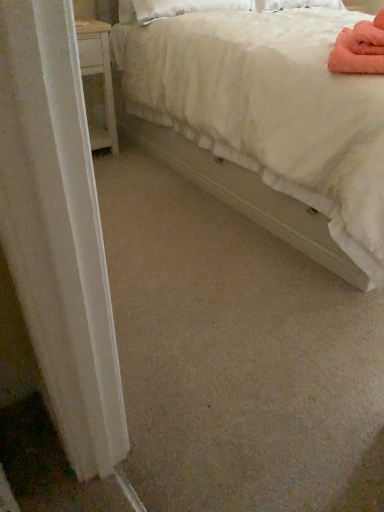
This screenshot has height=512, width=384. What do you see at coordinates (359, 48) in the screenshot? I see `pink fluffy bath towel at upper right` at bounding box center [359, 48].

The image size is (384, 512). What are the coordinates of `pink fluffy bath towel at upper right` in the screenshot? It's located at (359, 48).

Image resolution: width=384 pixels, height=512 pixels. I want to click on white fluffy bed at upper right, so click(265, 116).

What is the approximate width of white fluffy bed at upper right?

It is 7.21 feet.

Describe the element at coordinates (265, 116) in the screenshot. I see `white fluffy bed at upper right` at that location.

Locate an element on the screen. The width and height of the screenshot is (384, 512). pink fluffy bath towel at upper right is located at coordinates (359, 48).

Which object is positioned more to the right, pink fluffy bath towel at upper right or white fluffy bed at upper right?

white fluffy bed at upper right.

Does pink fluffy bath towel at upper right come in front of white fluffy bed at upper right?

No, pink fluffy bath towel at upper right is behind white fluffy bed at upper right.

Is point (383, 45) behind point (257, 155)?

No, (383, 45) is in front of (257, 155).

From the image's perspective, is pink fluffy bath towel at upper right located beneath white fluffy bed at upper right?

Correct, pink fluffy bath towel at upper right appears lower than white fluffy bed at upper right in the image.

From a real-world perspective, is pink fluffy bath towel at upper right above or below white fluffy bed at upper right?

In terms of real-world spatial position, pink fluffy bath towel at upper right is above white fluffy bed at upper right.

Which of these two, pink fluffy bath towel at upper right or white fluffy bed at upper right, is wider?

white fluffy bed at upper right.

Is pink fluffy bath towel at upper right shorter than white fluffy bed at upper right?

Correct, pink fluffy bath towel at upper right is not as tall as white fluffy bed at upper right.

Which of these two, pink fluffy bath towel at upper right or white fluffy bed at upper right, is smaller?

Smaller between the two is pink fluffy bath towel at upper right.

Is pink fluffy bath towel at upper right not within white fluffy bed at upper right?

No, most part of pink fluffy bath towel at upper right lies within white fluffy bed at upper right.

Would you consider pink fluffy bath towel at upper right to be distant from white fluffy bed at upper right?

pink fluffy bath towel at upper right is actually quite close to white fluffy bed at upper right.

Is pink fluffy bath towel at upper right oriented towards white fluffy bed at upper right?

Yes, pink fluffy bath towel at upper right faces towards white fluffy bed at upper right.

Find the location of `bed above the pink fluffy bath towel at upper right (from the image's perspective)`. bed above the pink fluffy bath towel at upper right (from the image's perspective) is located at coordinates (265, 116).

Is white fluffy bed at upper right at the left side of pink fluffy bath towel at upper right?

No.

Which is in front, white fluffy bed at upper right or pink fluffy bath towel at upper right?

white fluffy bed at upper right is closer to the camera.

From the picture: Which is closer to the camera, (x=194, y=123) or (x=333, y=71)?

The point (x=333, y=71) is in front.

From the image's perspective, is white fluffy bed at upper right positioned above or below pink fluffy bath towel at upper right?

white fluffy bed at upper right is situated higher than pink fluffy bath towel at upper right in the image.

From a real-world perspective, is white fluffy bed at upper right physically below pink fluffy bath towel at upper right?

Yes, from a real-world perspective, white fluffy bed at upper right is under pink fluffy bath towel at upper right.

Considering the sizes of white fluffy bed at upper right and pink fluffy bath towel at upper right in the image, is white fluffy bed at upper right wider or thinner than pink fluffy bath towel at upper right?

Considering their sizes, white fluffy bed at upper right looks broader than pink fluffy bath towel at upper right.

Is white fluffy bed at upper right taller than pink fluffy bath towel at upper right?

Yes.

Considering the sizes of objects white fluffy bed at upper right and pink fluffy bath towel at upper right in the image provided, who is smaller, white fluffy bed at upper right or pink fluffy bath towel at upper right?

With smaller size is pink fluffy bath towel at upper right.

Is white fluffy bed at upper right inside or outside of pink fluffy bath towel at upper right?

white fluffy bed at upper right is outside pink fluffy bath towel at upper right.

Are white fluffy bed at upper right and pink fluffy bath towel at upper right located far from each other?

white fluffy bed at upper right is near pink fluffy bath towel at upper right, not far away.

Could you tell me if white fluffy bed at upper right is turned towards pink fluffy bath towel at upper right?

Yes, white fluffy bed at upper right faces towards pink fluffy bath towel at upper right.

Can you tell me how much white fluffy bed at upper right and pink fluffy bath towel at upper right differ in facing direction?

The facing directions of white fluffy bed at upper right and pink fluffy bath towel at upper right are 52 degrees apart.

Find the location of a particular element. The width and height of the screenshot is (384, 512). bath towel behind the white fluffy bed at upper right is located at coordinates (359, 48).

You are a GUI agent. You are given a task and a screenshot of the screen. Output one action in this format:
    pyautogui.click(x=<x>, y=<y>)
    Task: Click on the bed that appears in front of the pink fluffy bath towel at upper right
    
    Given the screenshot: What is the action you would take?
    pyautogui.click(x=265, y=116)

You are a GUI agent. You are given a task and a screenshot of the screen. Output one action in this format:
    pyautogui.click(x=<x>, y=<y>)
    Task: Click on the bed to the right of pink fluffy bath towel at upper right
    This screenshot has height=512, width=384.
    Given the screenshot: What is the action you would take?
    pyautogui.click(x=265, y=116)